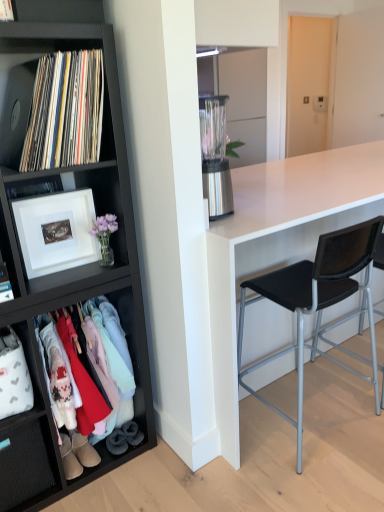
Identify the location of vacant area that is in front of stainless steel blender at center. The height and width of the screenshot is (512, 384). (228, 223).